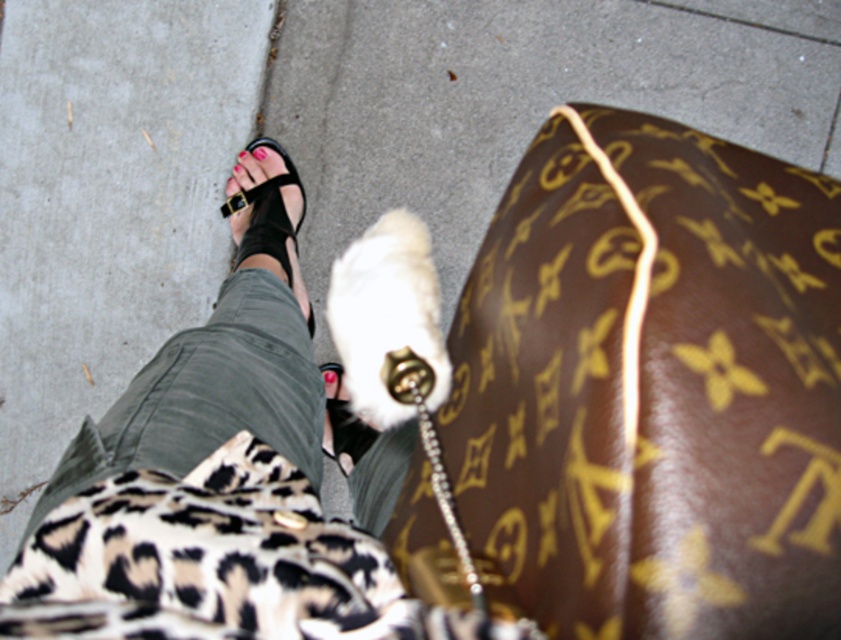
Does black leather sandal at center lie behind pink matte nail at center?

No, it is in front of pink matte nail at center.

Between point (284, 244) and point (257, 154), which one is positioned behind?

The point (257, 154) is behind.

Where is `black leather sandal at center`? black leather sandal at center is located at coordinates (267, 212).